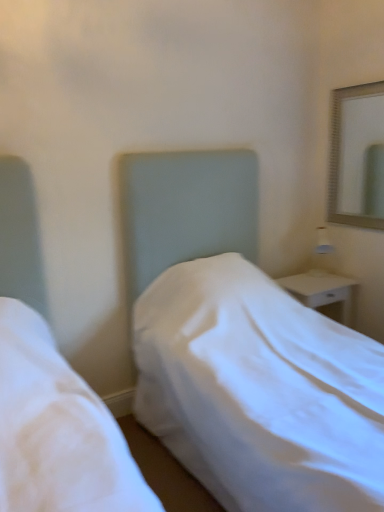
Question: Is white fabric bed at center inside or outside of silver metallic mirror at upper right?

Choices:
 (A) outside
 (B) inside

Answer: (A)

Question: From a real-world perspective, is white fabric bed at center positioned above or below silver metallic mirror at upper right?

Choices:
 (A) above
 (B) below

Answer: (B)

Question: Estimate the real-world distances between objects in this image. Which object is farther from the white glossy nightstand at right?

Choices:
 (A) silver metallic mirror at upper right
 (B) white fabric bed at center

Answer: (A)

Question: Which object is positioned closest to the silver metallic mirror at upper right?

Choices:
 (A) white fabric bed at center
 (B) white glossy nightstand at right

Answer: (B)